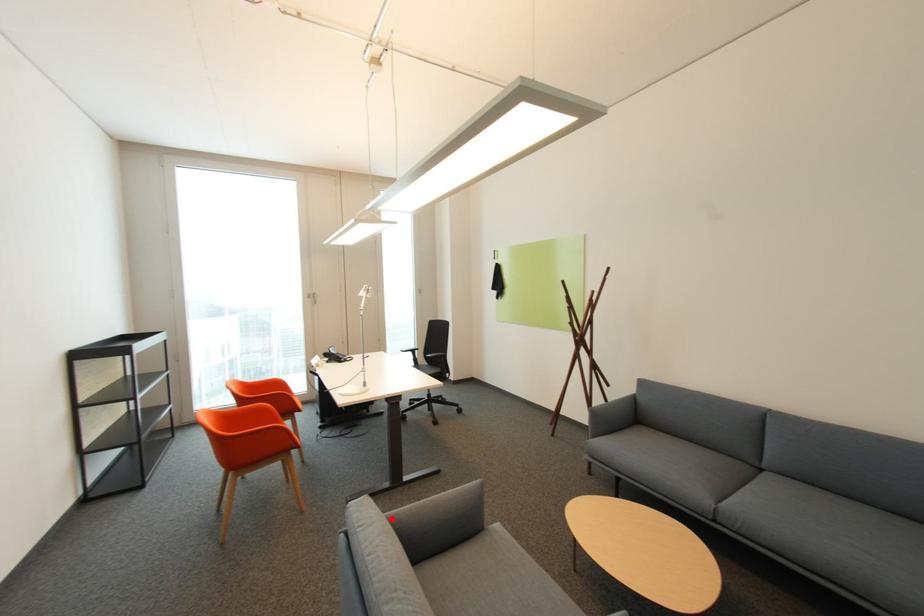
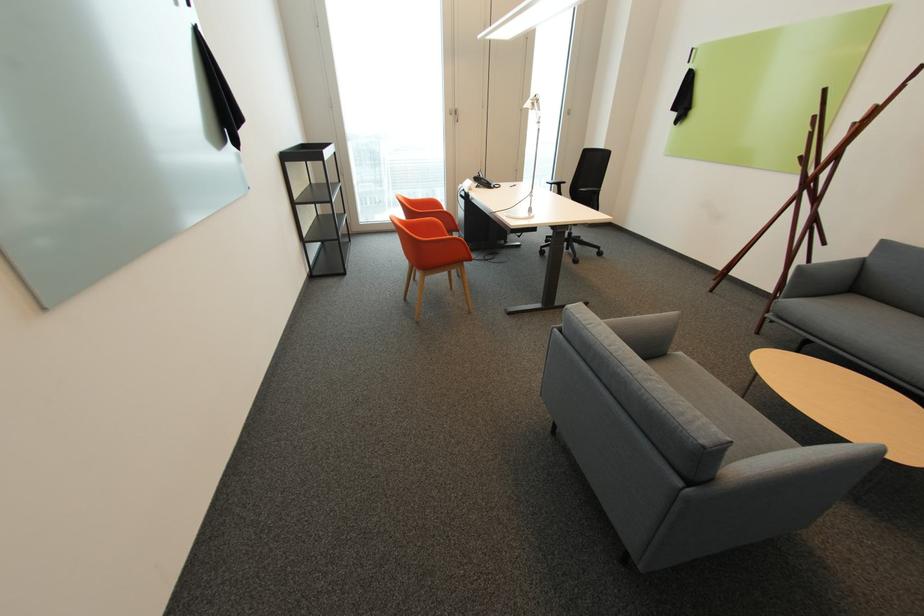
Question: I am providing you with two images of the same scene from different viewpoints. Given a red point in image1, look at the same physical point in image2. Is it:

Choices:
 (A) Closer to the viewpoint
 (B) Farther from the viewpoint

Answer: (B)